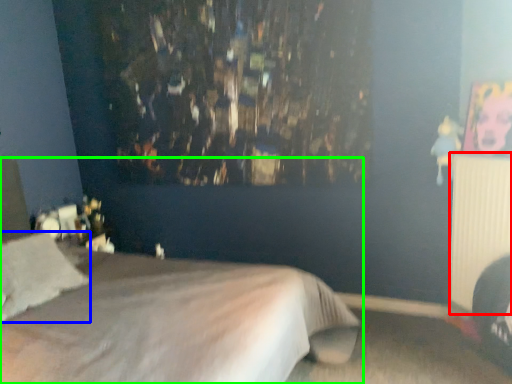
Question: Considering the real-world distances, which object is closest to radiator (highlighted by a red box)? pillow (highlighted by a blue box) or bed (highlighted by a green box).

Choices:
 (A) pillow
 (B) bed

Answer: (B)